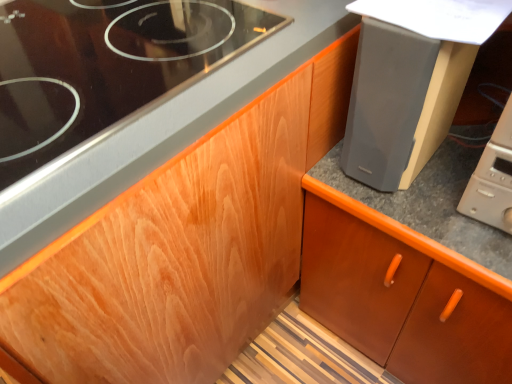
Question: Does beige plastic microwave at lower right have a lesser height compared to brown wood cabinet at center?

Choices:
 (A) no
 (B) yes

Answer: (B)

Question: Is beige plastic microwave at lower right to the right of brown wood cabinet at center from the viewer's perspective?

Choices:
 (A) no
 (B) yes

Answer: (A)

Question: Is beige plastic microwave at lower right taller than brown wood cabinet at center?

Choices:
 (A) yes
 (B) no

Answer: (B)

Question: From a real-world perspective, is beige plastic microwave at lower right on brown wood cabinet at center?

Choices:
 (A) yes
 (B) no

Answer: (A)

Question: From the image's perspective, does beige plastic microwave at lower right appear higher than brown wood cabinet at center?

Choices:
 (A) yes
 (B) no

Answer: (A)

Question: Is beige plastic microwave at lower right bigger than brown wood cabinet at center?

Choices:
 (A) yes
 (B) no

Answer: (B)

Question: From a real-world perspective, is brown wood cabinet at center physically above black glass gas stove at upper left?

Choices:
 (A) no
 (B) yes

Answer: (A)

Question: From the image's perspective, would you say brown wood cabinet at center is shown under black glass gas stove at upper left?

Choices:
 (A) no
 (B) yes

Answer: (B)

Question: Is brown wood cabinet at center placed right next to black glass gas stove at upper left?

Choices:
 (A) yes
 (B) no

Answer: (B)

Question: Does brown wood cabinet at center turn towards black glass gas stove at upper left?

Choices:
 (A) no
 (B) yes

Answer: (A)

Question: Does brown wood cabinet at center have a greater width compared to black glass gas stove at upper left?

Choices:
 (A) yes
 (B) no

Answer: (A)

Question: Does brown wood cabinet at center have a greater height compared to black glass gas stove at upper left?

Choices:
 (A) yes
 (B) no

Answer: (A)

Question: Can you confirm if black glass gas stove at upper left is positioned to the right of matte gray speaker at upper right?

Choices:
 (A) no
 (B) yes

Answer: (A)